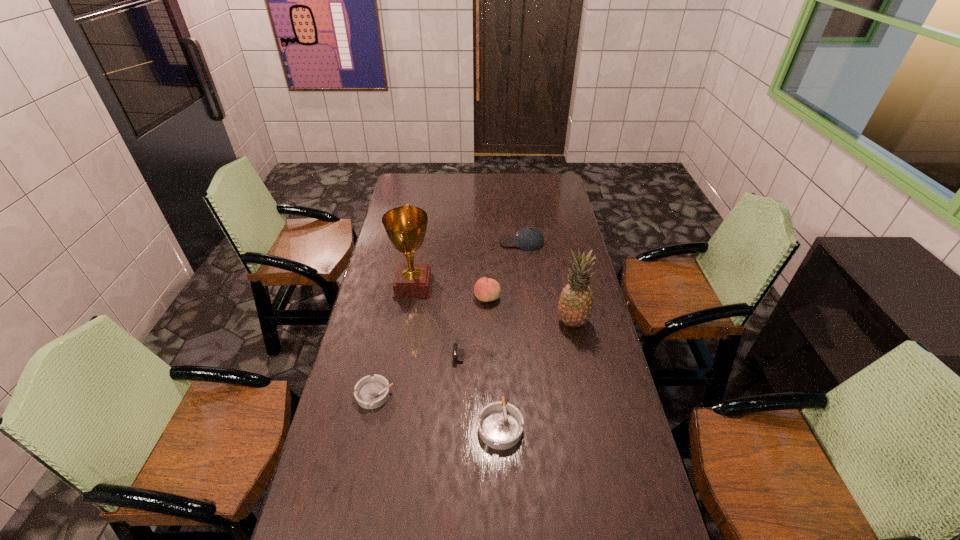
At what (x,y) coordinates should I click in order to perform the action: click on vacant space located 0.120m on the right of the right ashtray. Please return your answer as a coordinate pair (x, y). This screenshot has height=540, width=960. Looking at the image, I should click on (564, 426).

At what (x,y) coordinates should I click in order to perform the action: click on free space located on the front of the fifth shortest object. Please return your answer as a coordinate pair (x, y). This screenshot has height=540, width=960. Looking at the image, I should click on (488, 316).

You are a GUI agent. You are given a task and a screenshot of the screen. Output one action in this format:
    pyautogui.click(x=<x>, y=<y>)
    Task: Click on the vacant space located on the front-facing side of the farthest object
    
    Given the screenshot: What is the action you would take?
    pyautogui.click(x=457, y=242)

Identify the location of blank space located 0.100m on the front-facing side of the farthest object. (477, 242).

Locate an element on the screen. The height and width of the screenshot is (540, 960). free region located on the front-facing side of the farthest object is located at coordinates (428, 242).

You are a GUI agent. You are given a task and a screenshot of the screen. Output one action in this format:
    pyautogui.click(x=<x>, y=<y>)
    Task: Click on the free spot located on the plaque of the award
    Image resolution: width=960 pixels, height=540 pixels.
    Given the screenshot: What is the action you would take?
    pyautogui.click(x=484, y=286)

This screenshot has width=960, height=540. Find the location of `vacant area located 0.050m on the right of the pineapple`. vacant area located 0.050m on the right of the pineapple is located at coordinates (602, 322).

Image resolution: width=960 pixels, height=540 pixels. Identify the location of free space located on the front-facing side of the third nearest object. (359, 355).

Locate an element on the screen. This screenshot has width=960, height=540. blank area located on the front-facing side of the third nearest object is located at coordinates (365, 355).

In order to click on vacant region located on the front-facing side of the third nearest object in this screenshot , I will do `click(412, 355)`.